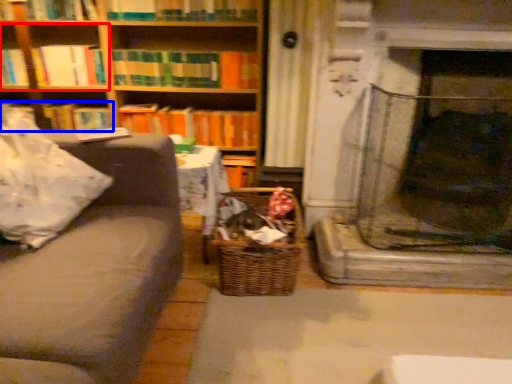
Question: Among these objects, which one is farthest to the camera, shelf (highlighted by a red box) or book (highlighted by a blue box)?

Choices:
 (A) shelf
 (B) book

Answer: (B)